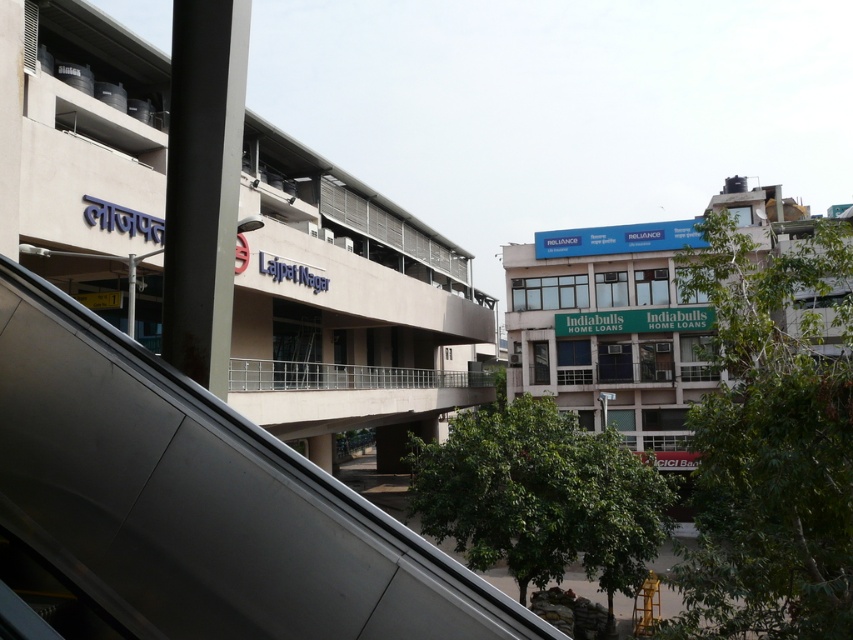
Consider the image. Between white glass building at right and silver metallic railing at center, which one has more height?

white glass building at right is taller.

Between point (645, 333) and point (265, 388), which one is positioned behind?

Positioned behind is point (645, 333).

Where is `white glass building at right`? The image size is (853, 640). white glass building at right is located at coordinates (612, 330).

Which is in front, point (372, 236) or point (321, 372)?

Point (321, 372)

Is point (44, 35) more distant than point (242, 378)?

No, (44, 35) is closer to viewer.

This screenshot has width=853, height=640. What are the coordinates of `beige concrete mall at center` in the screenshot? It's located at (345, 269).

Which is behind, point (71, 324) or point (413, 384)?

The point (413, 384) is more distant.

Does sleek silver escalator at left appear under silver metallic railing at center?

Actually, sleek silver escalator at left is above silver metallic railing at center.

The width and height of the screenshot is (853, 640). What do you see at coordinates (200, 500) in the screenshot?
I see `sleek silver escalator at left` at bounding box center [200, 500].

At what (x,y) coordinates should I click in order to perform the action: click on sleek silver escalator at left. Please return your answer as a coordinate pair (x, y). Looking at the image, I should click on (200, 500).